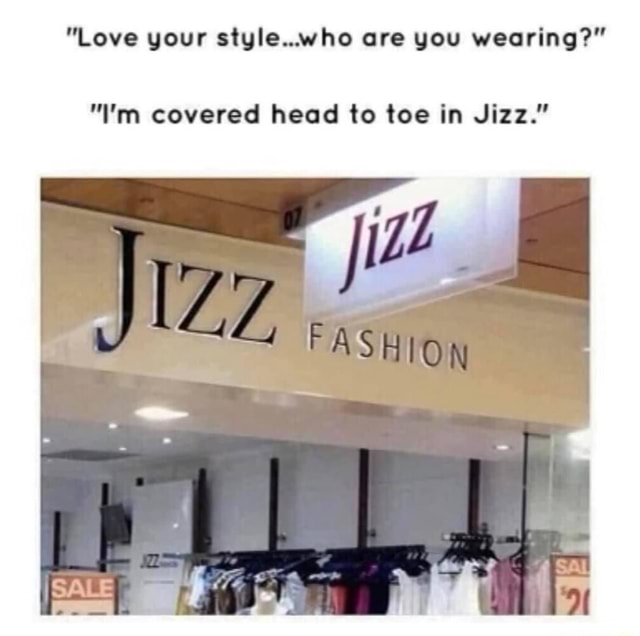
I want to click on right wall of store, so click(x=403, y=508).